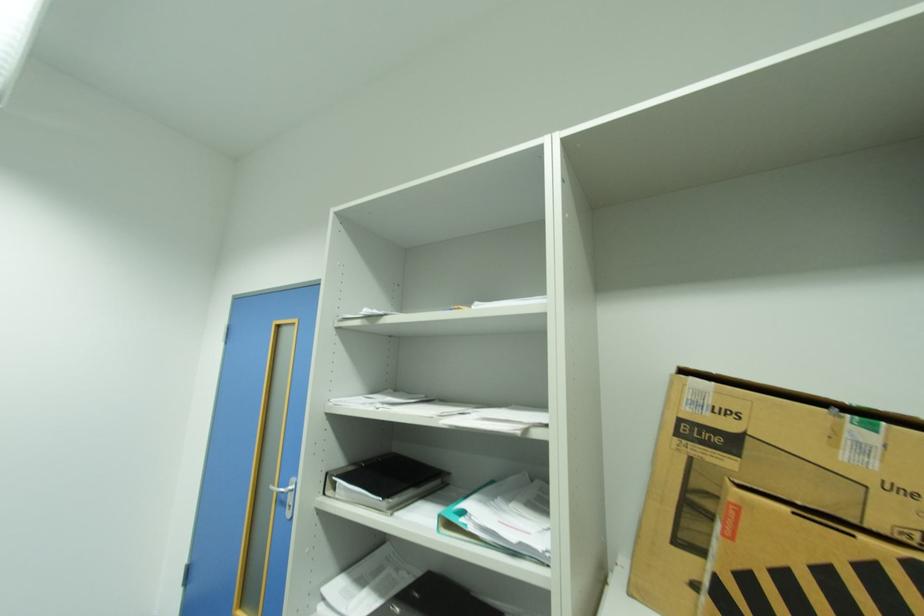
Identify the location of large cardboard box. 780,459.